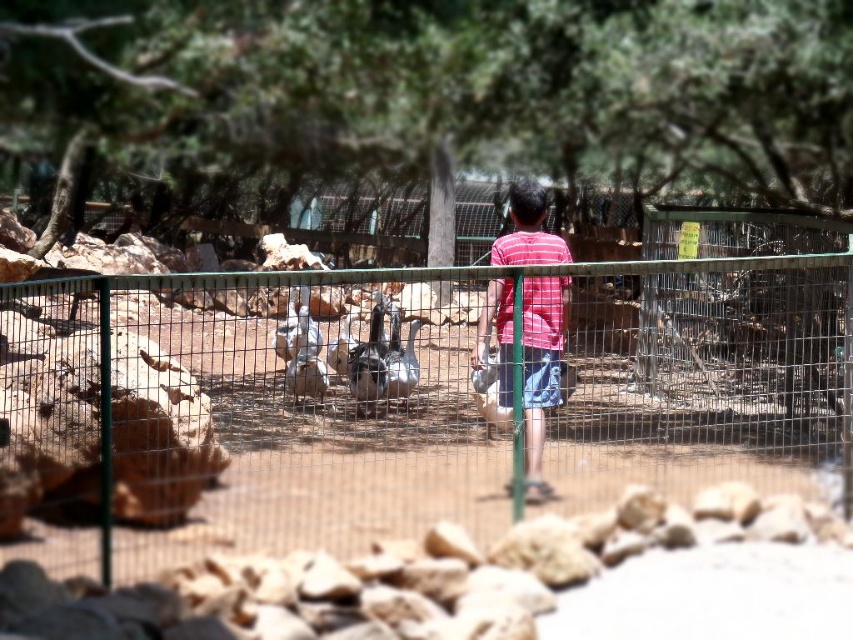
Question: Which of the following is the farthest from the observer?

Choices:
 (A) (541, 452)
 (B) (566, 451)

Answer: (A)

Question: Does green wire mesh fence at center come in front of striped cotton shirt at center?

Choices:
 (A) yes
 (B) no

Answer: (A)

Question: Which of the following is the farthest from the observer?

Choices:
 (A) (119, 524)
 (B) (483, 340)

Answer: (B)

Question: Can you confirm if green wire mesh fence at center is positioned to the left of striped cotton shirt at center?

Choices:
 (A) no
 (B) yes

Answer: (B)

Question: Is green wire mesh fence at center wider than striped cotton shirt at center?

Choices:
 (A) yes
 (B) no

Answer: (A)